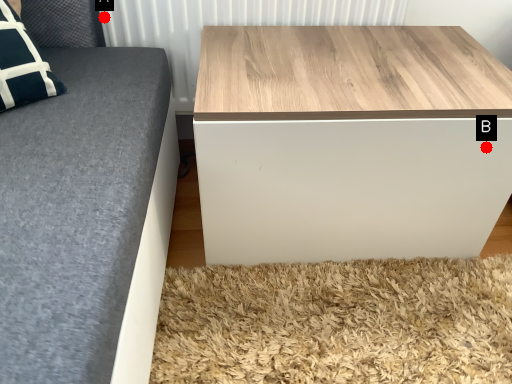
Question: Two points are circled on the image, labeled by A and B beside each circle. Which point is closer to the camera?

Choices:
 (A) A is closer
 (B) B is closer

Answer: (B)